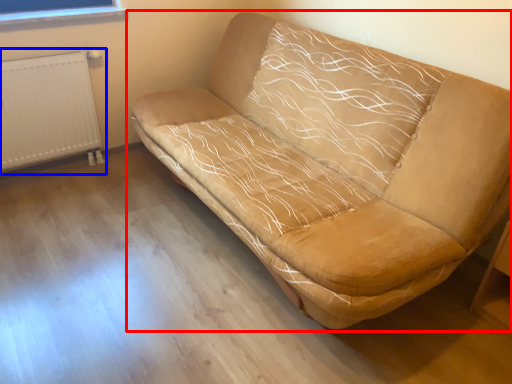
Question: Which object is further to the camera taking this photo, studio couch (highlighted by a red box) or radiator (highlighted by a blue box)?

Choices:
 (A) studio couch
 (B) radiator

Answer: (B)